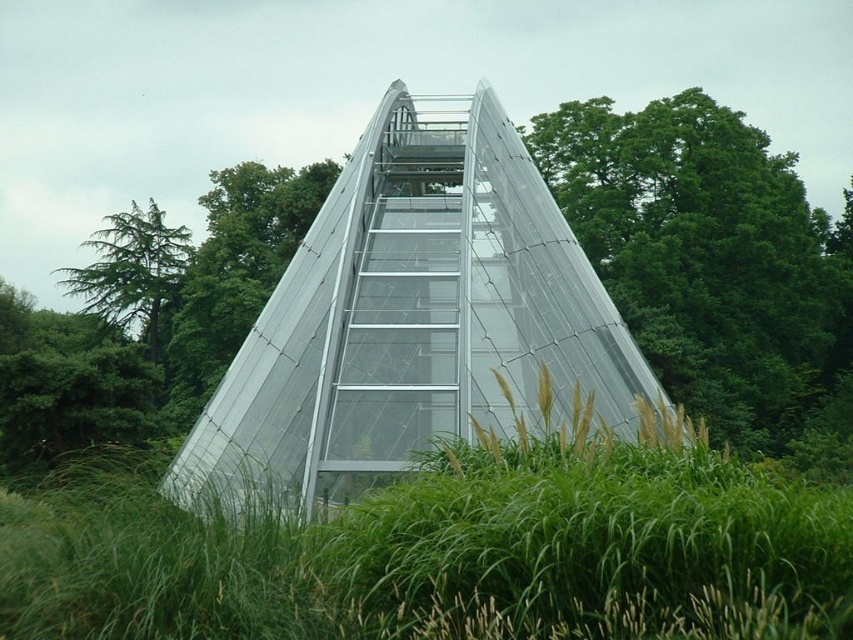
Question: Which of the following is the closest to the observer?

Choices:
 (A) (560, 472)
 (B) (274, 221)
 (C) (1, 458)

Answer: (A)

Question: Which of the following is the farthest from the observer?

Choices:
 (A) green leafy tree at center
 (B) green needle-like leaves at left

Answer: (B)

Question: Estimate the real-world distances between objects in this image. Which object is farther from the green grass at center?

Choices:
 (A) green needle-like leaves at left
 (B) green leafy tree at upper right
 (C) transparent glass pyramid at center
 (D) green leafy tree at left

Answer: (A)

Question: Is green grass at center smaller than green leafy tree at left?

Choices:
 (A) no
 (B) yes

Answer: (B)

Question: Does green leafy tree at upper right have a smaller size compared to green leafy tree at left?

Choices:
 (A) yes
 (B) no

Answer: (B)

Question: Does transparent glass pyramid at center appear on the right side of green leafy tree at left?

Choices:
 (A) no
 (B) yes

Answer: (B)